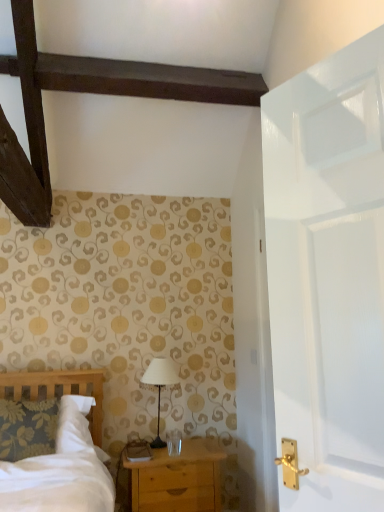
I want to click on white fabric lampshade at center, so click(160, 386).

This screenshot has width=384, height=512. Describe the element at coordinates (160, 386) in the screenshot. I see `white fabric lampshade at center` at that location.

Image resolution: width=384 pixels, height=512 pixels. Describe the element at coordinates (177, 479) in the screenshot. I see `light brown wooden chest of drawers at lower center` at that location.

Locate an element on the screen. light brown wooden chest of drawers at lower center is located at coordinates (177, 479).

The height and width of the screenshot is (512, 384). I want to click on white fabric lampshade at center, so click(160, 386).

In the image, is white fabric lampshade at center on the left side or the right side of light brown wooden chest of drawers at lower center?

white fabric lampshade at center is positioned on light brown wooden chest of drawers at lower center's left side.

Is white fabric lampshade at center positioned in front of light brown wooden chest of drawers at lower center?

That is False.

Is point (161, 360) positioned in front of point (173, 499)?

No.

From the image's perspective, which one is positioned higher, white fabric lampshade at center or light brown wooden chest of drawers at lower center?

white fabric lampshade at center.

From a real-world perspective, does white fabric lampshade at center stand above light brown wooden chest of drawers at lower center?

Indeed, from a real-world perspective, white fabric lampshade at center stands above light brown wooden chest of drawers at lower center.

Can you confirm if white fabric lampshade at center is thinner than light brown wooden chest of drawers at lower center?

Indeed, white fabric lampshade at center has a lesser width compared to light brown wooden chest of drawers at lower center.

Can you confirm if white fabric lampshade at center is taller than light brown wooden chest of drawers at lower center?

Indeed, white fabric lampshade at center has a greater height compared to light brown wooden chest of drawers at lower center.

Based on the photo, between white fabric lampshade at center and light brown wooden chest of drawers at lower center, which one has larger size?

Bigger between the two is light brown wooden chest of drawers at lower center.

In the scene shown: Could light brown wooden chest of drawers at lower center be considered to be inside white fabric lampshade at center?

No, light brown wooden chest of drawers at lower center is not inside white fabric lampshade at center.

Is white fabric lampshade at center far away from light brown wooden chest of drawers at lower center?

No, there isn't a large distance between white fabric lampshade at center and light brown wooden chest of drawers at lower center.

Does white fabric lampshade at center turn towards light brown wooden chest of drawers at lower center?

No, white fabric lampshade at center does not turn towards light brown wooden chest of drawers at lower center.

Can you tell me how much white fabric lampshade at center and light brown wooden chest of drawers at lower center differ in facing direction?

white fabric lampshade at center and light brown wooden chest of drawers at lower center are facing 0.507 degrees away from each other.

I want to click on chest of drawers below the white fabric lampshade at center (from a real-world perspective), so click(x=177, y=479).

Is light brown wooden chest of drawers at lower center to the right of white fabric lampshade at center from the viewer's perspective?

Yes.

Considering the positions of objects light brown wooden chest of drawers at lower center and white fabric lampshade at center in the image provided, who is behind, light brown wooden chest of drawers at lower center or white fabric lampshade at center?

Positioned behind is white fabric lampshade at center.

Is point (161, 482) positioned in front of point (168, 376)?

Yes, it is in front of point (168, 376).

From the image's perspective, is light brown wooden chest of drawers at lower center below white fabric lampshade at center?

Yes, from the image's perspective, light brown wooden chest of drawers at lower center is below white fabric lampshade at center.

From a real-world perspective, is light brown wooden chest of drawers at lower center located beneath white fabric lampshade at center?

Yes, from a real-world perspective, light brown wooden chest of drawers at lower center is below white fabric lampshade at center.

Which object is wider, light brown wooden chest of drawers at lower center or white fabric lampshade at center?

Wider between the two is light brown wooden chest of drawers at lower center.

Can you confirm if light brown wooden chest of drawers at lower center is taller than white fabric lampshade at center?

No.

Is light brown wooden chest of drawers at lower center smaller than white fabric lampshade at center?

No, light brown wooden chest of drawers at lower center is not smaller than white fabric lampshade at center.

Which is correct: light brown wooden chest of drawers at lower center is inside white fabric lampshade at center, or outside of it?

light brown wooden chest of drawers at lower center exists outside the volume of white fabric lampshade at center.

In the scene shown: Is light brown wooden chest of drawers at lower center not near white fabric lampshade at center?

They are positioned close to each other.

Is light brown wooden chest of drawers at lower center looking in the opposite direction of white fabric lampshade at center?

light brown wooden chest of drawers at lower center is not turned away from white fabric lampshade at center.

At what (x,y) coordinates should I click in order to perform the action: click on table lamp above the light brown wooden chest of drawers at lower center (from the image's perspective). Please return your answer as a coordinate pair (x, y). This screenshot has height=512, width=384. Looking at the image, I should click on tap(160, 386).

In the image, there is a light brown wooden chest of drawers at lower center. At what (x,y) coordinates should I click in order to perform the action: click on table lamp above it (from the image's perspective). Please return your answer as a coordinate pair (x, y). This screenshot has width=384, height=512. Looking at the image, I should click on (160, 386).

You are a GUI agent. You are given a task and a screenshot of the screen. Output one action in this format:
    pyautogui.click(x=<x>, y=<y>)
    Task: Click on the table lamp on the left side of light brown wooden chest of drawers at lower center
    This screenshot has height=512, width=384.
    Given the screenshot: What is the action you would take?
    pyautogui.click(x=160, y=386)